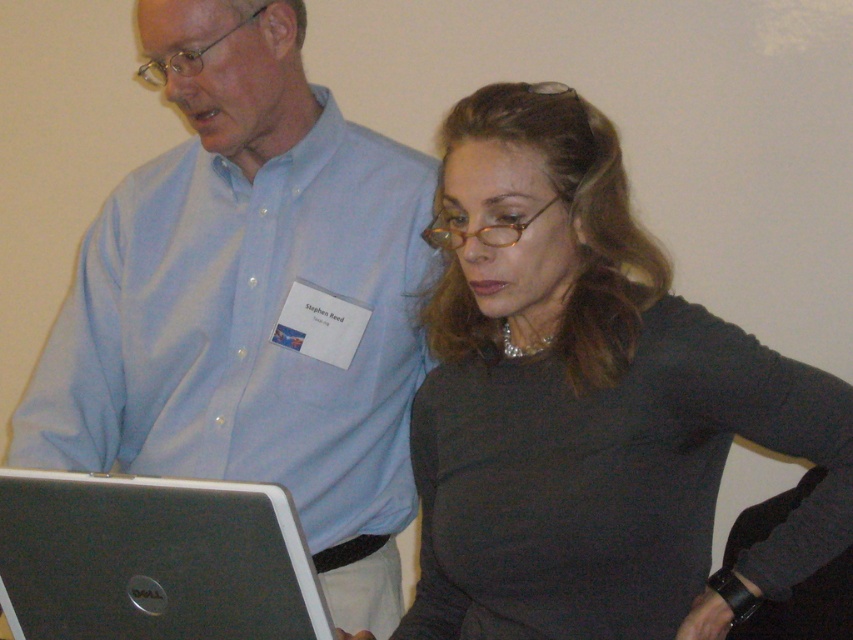
You are a photographer setting up for a group photo. You notice the matte blue shirt at center and the silver metallic laptop at lower left. Which object is positioned higher in the frame?

The matte blue shirt at center is positioned higher in the frame than the silver metallic laptop at lower left.

From the picture: You are standing in front of the two people in the image. Which item, the matte gray sweater at center or the matte blue shirt at center, would you see first if you look straight ahead?

The matte gray sweater at center would be seen first because it is closer to the viewer than the matte blue shirt at center.